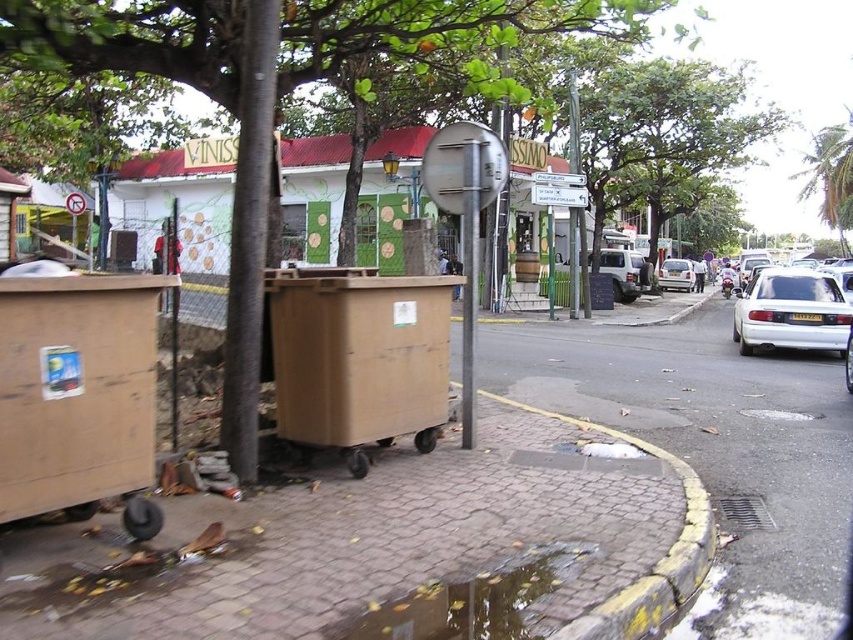
You are a delivery person who needs to park your van between the white glossy sedan at right and the white matte car at center. The van is 6 meters long. Is there enough space between them to park your van?

The distance between the white glossy sedan at right and the white matte car at center is 12.87 meters. Since the van is 6 meters long, there is sufficient space to park between them as 12.87 meters is greater than 6 meters.

You are standing in front of the two cardboard bins on the street. You notice two points marked on the ground at coordinates point (367, 3) and point (666, 264). Which point is closer to you?

Point (367, 3) is closer to the camera than point (666, 264), so the point closer to you is point (367, 3).

You are a delivery person trying to park your van between the two cars in the scene. The white glossy sedan at right and the white matte car at center are in your way. Based on their positions, which car should you move first to create space?

The white glossy sedan at right is below the white matte car at center, so you should move the white matte car at center first since it is positioned higher and might block access to the lower one.